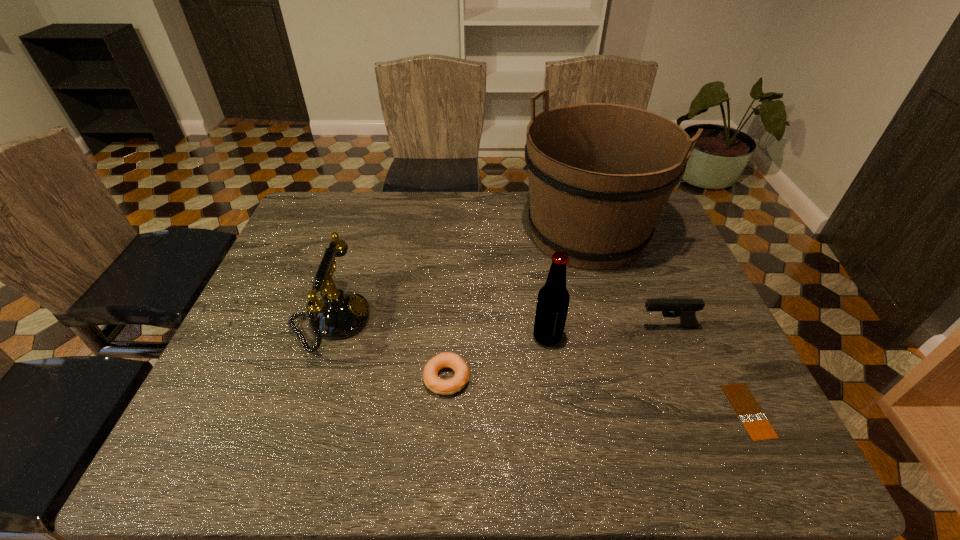
Locate an element on the screen. The image size is (960, 540). free spot between the beer bottle and the bagel is located at coordinates (497, 357).

Find the location of a particular element. The image size is (960, 540). vacant area between the shortest object and the bucket is located at coordinates click(x=668, y=322).

Locate an element on the screen. The image size is (960, 540). empty space that is in between the fourth shortest object and the shortest object is located at coordinates (540, 366).

Where is `free spot between the fifth shortest object and the fourth tallest object`? The width and height of the screenshot is (960, 540). free spot between the fifth shortest object and the fourth tallest object is located at coordinates click(x=608, y=332).

Where is `empty space that is in between the beer bottle and the tallest object`? This screenshot has width=960, height=540. empty space that is in between the beer bottle and the tallest object is located at coordinates (567, 285).

Where is `empty space between the bucket and the beer bottle`? This screenshot has height=540, width=960. empty space between the bucket and the beer bottle is located at coordinates (567, 285).

Locate an element on the screen. vacant point located between the shortest object and the fifth shortest object is located at coordinates (648, 374).

You are a GUI agent. You are given a task and a screenshot of the screen. Output one action in this format:
    pyautogui.click(x=<x>, y=<y>)
    Task: Click on the free space between the shortest object and the fifth tallest object
    The width and height of the screenshot is (960, 540).
    Given the screenshot: What is the action you would take?
    pyautogui.click(x=597, y=394)

Find the location of a particular element. vacant point located between the bucket and the fourth tallest object is located at coordinates (627, 280).

The image size is (960, 540). I want to click on free space that is in between the tallest object and the telephone, so click(x=460, y=277).